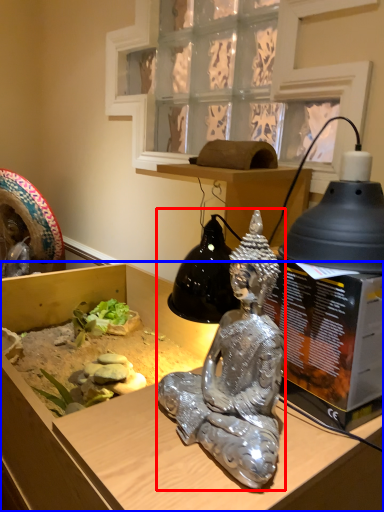
Question: Among these objects, which one is farthest to the camera, person (highlighted by a red box) or furniture (highlighted by a blue box)?

Choices:
 (A) person
 (B) furniture

Answer: (A)